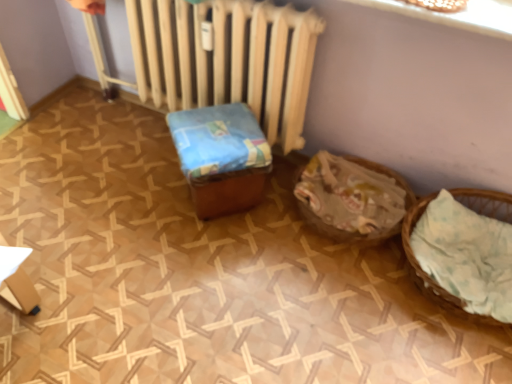
The width and height of the screenshot is (512, 384). What do you see at coordinates (227, 59) in the screenshot?
I see `white matte radiator at center` at bounding box center [227, 59].

I want to click on white matte radiator at center, so click(227, 59).

Considering the relative sizes of white matte radiator at center and brown woven basket at lower right, the second basket positioned from the right, in the image provided, is white matte radiator at center smaller than brown woven basket at lower right, the second basket positioned from the right,?

No.

Considering the sizes of objects white matte radiator at center and brown woven basket at lower right, the second basket positioned from the right, in the image provided, who is wider, white matte radiator at center or brown woven basket at lower right, the second basket positioned from the right,?

brown woven basket at lower right, the second basket positioned from the right.

Can you confirm if white matte radiator at center is shorter than brown woven basket at lower right, arranged as the first basket when viewed from the left?

In fact, white matte radiator at center may be taller than brown woven basket at lower right, arranged as the first basket when viewed from the left.

Which is correct: white matte radiator at center is inside brown woven basket at lower right, the second basket positioned from the right, or outside of it?

white matte radiator at center cannot be found inside brown woven basket at lower right, the second basket positioned from the right.

Does point (322, 151) come in front of point (228, 183)?

That is False.

Is the depth of brown woven basket at lower right, the second basket positioned from the right, greater than that of blue fabric-covered box at center?

Yes, it is.

Does brown woven basket at lower right, arranged as the first basket when viewed from the left, have a lesser width compared to blue fabric-covered box at center?

Incorrect, the width of brown woven basket at lower right, arranged as the first basket when viewed from the left, is not less than that of blue fabric-covered box at center.

The width and height of the screenshot is (512, 384). I want to click on basket in front of the blue fabric-covered box at center, so click(x=464, y=249).

From the image's perspective, between blue fabric-covered box at center and light brown woven basket at right, arranged as the 2th basket when viewed from the left, who is located below?

light brown woven basket at right, arranged as the 2th basket when viewed from the left.

Could you tell me if blue fabric-covered box at center is facing light brown woven basket at right, arranged as the 1th basket when viewed from the right?

No, blue fabric-covered box at center is not facing towards light brown woven basket at right, arranged as the 1th basket when viewed from the right.

In the scene shown: Does blue fabric-covered box at center lie in front of light brown woven basket at right, arranged as the 2th basket when viewed from the left?

No, blue fabric-covered box at center is further to the viewer.

From the image's perspective, relative to light brown woven basket at right, arranged as the 2th basket when viewed from the left, is brown woven basket at lower right, arranged as the first basket when viewed from the left, above or below?

Clearly, from the image's perspective, brown woven basket at lower right, arranged as the first basket when viewed from the left, is above light brown woven basket at right, arranged as the 2th basket when viewed from the left.

From the picture: Which is in front, brown woven basket at lower right, the second basket positioned from the right, or light brown woven basket at right, arranged as the 2th basket when viewed from the left?

Positioned in front is light brown woven basket at right, arranged as the 2th basket when viewed from the left.

Could you tell me if brown woven basket at lower right, the second basket positioned from the right, is facing light brown woven basket at right, arranged as the 2th basket when viewed from the left?

No, brown woven basket at lower right, the second basket positioned from the right, is not oriented towards light brown woven basket at right, arranged as the 2th basket when viewed from the left.

From a real-world perspective, is blue fabric-covered box at center beneath white matte radiator at center?

Yes, from a real-world perspective, blue fabric-covered box at center is under white matte radiator at center.

From the image's perspective, is blue fabric-covered box at center located above or below white matte radiator at center?

From the image's perspective, blue fabric-covered box at center appears below white matte radiator at center.

Are blue fabric-covered box at center and white matte radiator at center far apart?

No.

Does blue fabric-covered box at center have a lesser width compared to white matte radiator at center?

No.

Which is more to the left, brown woven basket at lower right, arranged as the first basket when viewed from the left, or white matte radiator at center?

Positioned to the left is white matte radiator at center.

Looking at this image, is white matte radiator at center completely or partially inside brown woven basket at lower right, the second basket positioned from the right?

No, brown woven basket at lower right, the second basket positioned from the right, does not contain white matte radiator at center.

Can you confirm if brown woven basket at lower right, arranged as the first basket when viewed from the left, is taller than white matte radiator at center?

Incorrect, the height of brown woven basket at lower right, arranged as the first basket when viewed from the left, is not larger of that of white matte radiator at center.

From a real-world perspective, who is located higher, brown woven basket at lower right, arranged as the first basket when viewed from the left, or white matte radiator at center?

white matte radiator at center is physically above.

Could you tell me if white matte radiator at center is facing blue fabric-covered box at center?

Yes, white matte radiator at center is oriented towards blue fabric-covered box at center.

Based on their positions, is white matte radiator at center located to the left or right of blue fabric-covered box at center?

white matte radiator at center is positioned on blue fabric-covered box at center's left side.

From the picture: Would you say white matte radiator at center is a long distance from blue fabric-covered box at center?

No, white matte radiator at center is in close proximity to blue fabric-covered box at center.

Considering the positions of point (254, 53) and point (202, 148), is point (254, 53) closer or farther from the camera than point (202, 148)?

Point (254, 53) appears to be farther away from the viewer than point (202, 148).

The image size is (512, 384). I want to click on basket that is the 2nd object directly below the white matte radiator at center (from a real-world perspective), so click(352, 198).

Identify the location of basket behind the blue fabric-covered box at center. (352, 198).

When comparing their distances from blue fabric-covered box at center, does brown woven basket at lower right, arranged as the first basket when viewed from the left, or light brown woven basket at right, arranged as the 1th basket when viewed from the right, seem closer?

Based on the image, brown woven basket at lower right, arranged as the first basket when viewed from the left, appears to be nearer to blue fabric-covered box at center.

Looking at the image, which one is located closer to light brown woven basket at right, arranged as the 1th basket when viewed from the right, white matte radiator at center or blue fabric-covered box at center?

blue fabric-covered box at center.

Looking at the image, which one is located closer to brown woven basket at lower right, arranged as the first basket when viewed from the left, light brown woven basket at right, arranged as the 2th basket when viewed from the left, or white matte radiator at center?

light brown woven basket at right, arranged as the 2th basket when viewed from the left, is closer to brown woven basket at lower right, arranged as the first basket when viewed from the left.

In the scene shown: Considering their positions, is blue fabric-covered box at center positioned closer to white matte radiator at center than light brown woven basket at right, arranged as the 2th basket when viewed from the left?

blue fabric-covered box at center is positioned closer to the anchor white matte radiator at center.

When comparing their distances from brown woven basket at lower right, arranged as the first basket when viewed from the left, does blue fabric-covered box at center or light brown woven basket at right, arranged as the 2th basket when viewed from the left, seem closer?

Among the two, light brown woven basket at right, arranged as the 2th basket when viewed from the left, is located nearer to brown woven basket at lower right, arranged as the first basket when viewed from the left.

Which object lies nearer to the anchor point light brown woven basket at right, arranged as the 1th basket when viewed from the right, white matte radiator at center or brown woven basket at lower right, arranged as the first basket when viewed from the left?

brown woven basket at lower right, arranged as the first basket when viewed from the left.

Looking at the image, which one is located closer to blue fabric-covered box at center, light brown woven basket at right, arranged as the 2th basket when viewed from the left, or white matte radiator at center?

white matte radiator at center lies closer to blue fabric-covered box at center than the other object.

Considering their positions, is brown woven basket at lower right, arranged as the first basket when viewed from the left, positioned closer to blue fabric-covered box at center than white matte radiator at center?

white matte radiator at center.

This screenshot has width=512, height=384. I want to click on furniture between white matte radiator at center and light brown woven basket at right, arranged as the 2th basket when viewed from the left, so click(221, 157).

Find the location of a particular element. This screenshot has height=384, width=512. basket between blue fabric-covered box at center and light brown woven basket at right, arranged as the 1th basket when viewed from the right, in the horizontal direction is located at coordinates (352, 198).

Where is `basket located between white matte radiator at center and light brown woven basket at right, arranged as the 2th basket when viewed from the left, in the left-right direction`? Image resolution: width=512 pixels, height=384 pixels. basket located between white matte radiator at center and light brown woven basket at right, arranged as the 2th basket when viewed from the left, in the left-right direction is located at coordinates point(352,198).

Locate an element on the screen. Image resolution: width=512 pixels, height=384 pixels. furniture between white matte radiator at center and brown woven basket at lower right, arranged as the first basket when viewed from the left, in the horizontal direction is located at coordinates (221, 157).